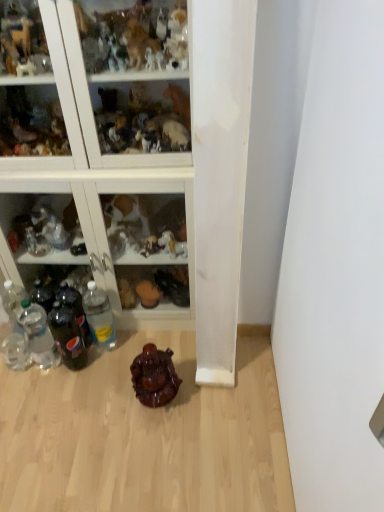
Where is `free space to the left of dark glass bottle at lower left, the second bottle in the right-to-left sequence`? free space to the left of dark glass bottle at lower left, the second bottle in the right-to-left sequence is located at coordinates tap(38, 379).